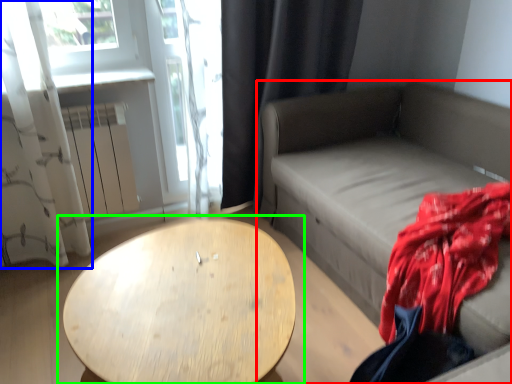
Question: Which object is the closest to the studio couch (highlighted by a red box)? Choose among these: curtain (highlighted by a blue box) or table (highlighted by a green box).

Choices:
 (A) curtain
 (B) table

Answer: (B)